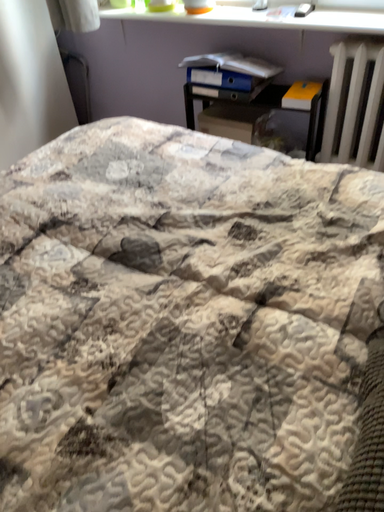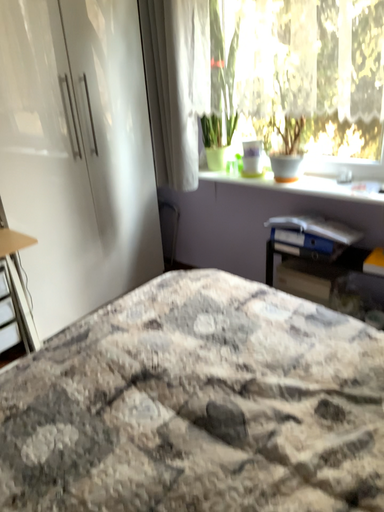
Question: How did the camera likely rotate when shooting the video?

Choices:
 (A) rotated downward
 (B) rotated upward

Answer: (B)